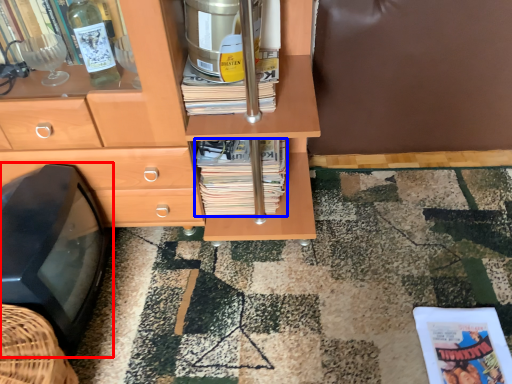
Question: Among these objects, which one is nearest to the camera, flat (highlighted by a red box) or magazine (highlighted by a blue box)?

Choices:
 (A) flat
 (B) magazine

Answer: (A)